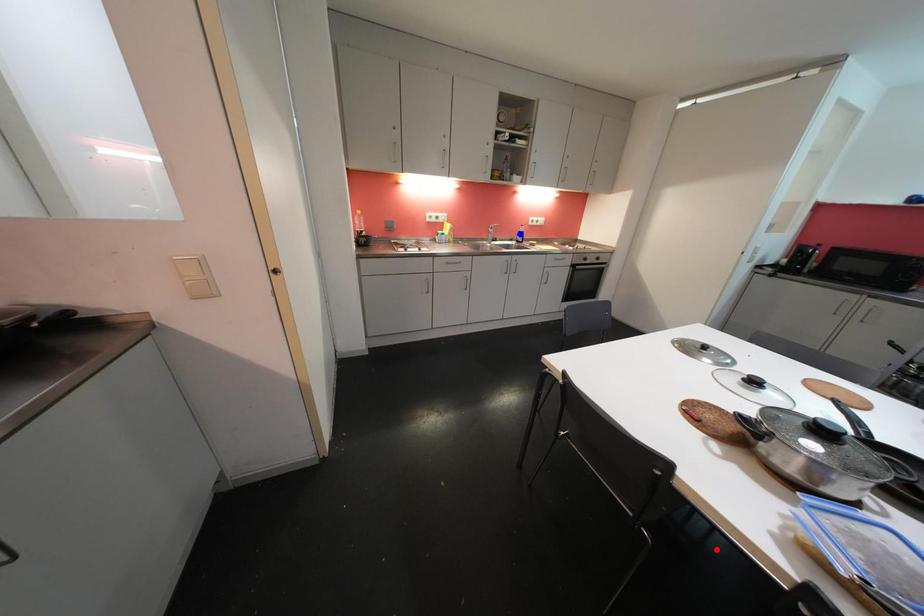
Question: Two points are marked on the image. Which point is closer to the camera?

Choices:
 (A) Blue point is closer.
 (B) Red point is closer.

Answer: (B)